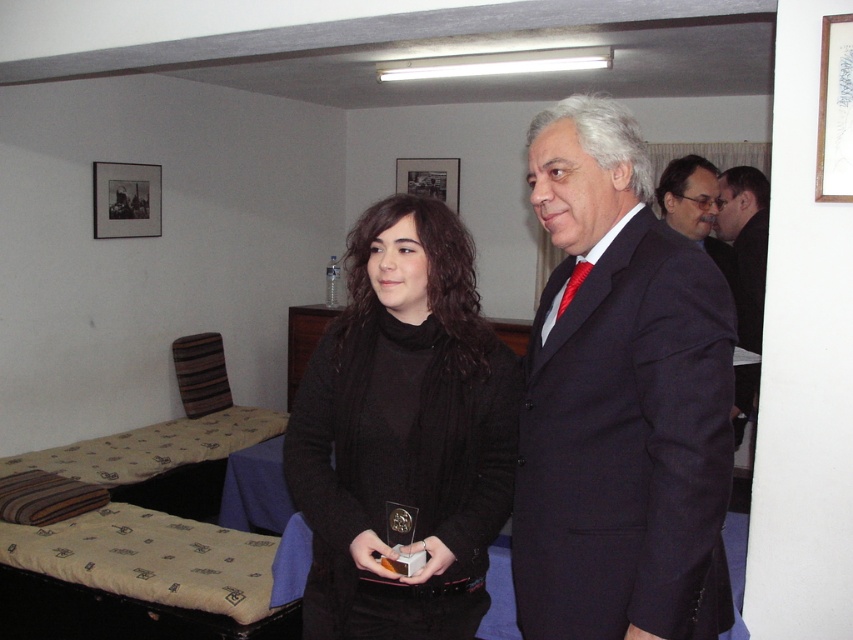
Who is more distant from viewer, (x=299, y=460) or (x=132, y=177)?

Point (x=132, y=177)

In the scene shown: Is black knitted sweater at center above matte black picture frame at upper left?

Actually, black knitted sweater at center is below matte black picture frame at upper left.

The height and width of the screenshot is (640, 853). Identify the location of black knitted sweater at center. (403, 433).

Measure the distance between point [732,284] and camera.

They are 3.01 meters apart.

Where is `matte black suit at center`? matte black suit at center is located at coordinates (695, 208).

Where is `matte black suit at center`? matte black suit at center is located at coordinates (695, 208).

Between matte black picture frame at upper left and black matte picture frame at upper center, which one appears on the left side from the viewer's perspective?

matte black picture frame at upper left

Which of these two, matte black picture frame at upper left or black matte picture frame at upper center, stands taller?

matte black picture frame at upper left

Where is `matte black picture frame at upper left`? This screenshot has height=640, width=853. matte black picture frame at upper left is located at coordinates (126, 198).